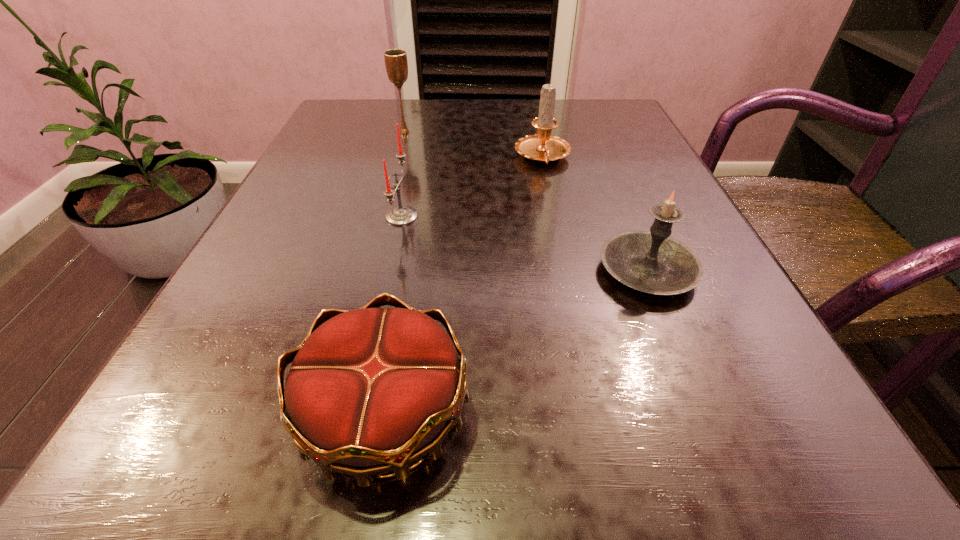
You are a GUI agent. You are given a task and a screenshot of the screen. Output one action in this format:
    pyautogui.click(x=<x>, y=<y>)
    Task: Click on the candle at the far edge
    The height and width of the screenshot is (540, 960).
    Given the screenshot: What is the action you would take?
    pyautogui.click(x=542, y=147)

Where is `object at the near edge`? This screenshot has height=540, width=960. object at the near edge is located at coordinates (371, 390).

Find the location of a particular element. The image size is (960, 540). chalice that is at the left edge is located at coordinates (396, 63).

Locate an element on the screen. crown positioned at the left edge is located at coordinates (371, 390).

The height and width of the screenshot is (540, 960). I want to click on object situated at the right edge, so click(x=652, y=262).

You are a GUI agent. You are given a task and a screenshot of the screen. Output one action in this format:
    pyautogui.click(x=<x>, y=<y>)
    Task: Click on the object located in the far left corner section of the desktop
    
    Given the screenshot: What is the action you would take?
    tap(396, 63)

At what (x,y) coordinates should I click in order to perform the action: click on object situated at the near left corner. Please return your answer as a coordinate pair (x, y). Looking at the image, I should click on (371, 390).

This screenshot has height=540, width=960. Identify the location of vacant area at the far edge of the desktop. (446, 132).

Locate an element on the screen. The width and height of the screenshot is (960, 540). vacant space at the near edge is located at coordinates (588, 441).

I want to click on vacant point at the left edge, so click(x=310, y=167).